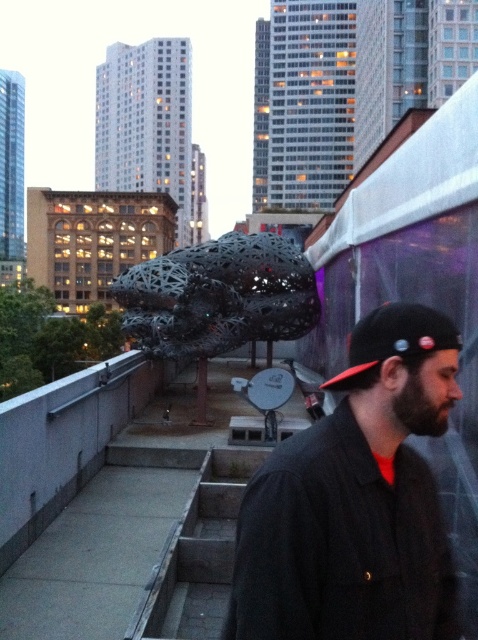
Question: Can you confirm if black matte jacket at right is positioned below black wire mesh sculpture at center?

Choices:
 (A) yes
 (B) no

Answer: (A)

Question: Which object is closer to the camera taking this photo?

Choices:
 (A) black wire mesh sculpture at center
 (B) black matte jacket at right

Answer: (B)

Question: Considering the real-world distances, which object is closest to the black matte jacket at right?

Choices:
 (A) black fabric baseball cap at right
 (B) black wire mesh sculpture at center

Answer: (A)

Question: Is black matte jacket at right behind black wire mesh sculpture at center?

Choices:
 (A) no
 (B) yes

Answer: (A)

Question: Can you confirm if black matte jacket at right is bigger than black wire mesh sculpture at center?

Choices:
 (A) yes
 (B) no

Answer: (B)

Question: Which of the following is the farthest from the observer?

Choices:
 (A) black fabric baseball cap at right
 (B) black wire mesh sculpture at center

Answer: (B)